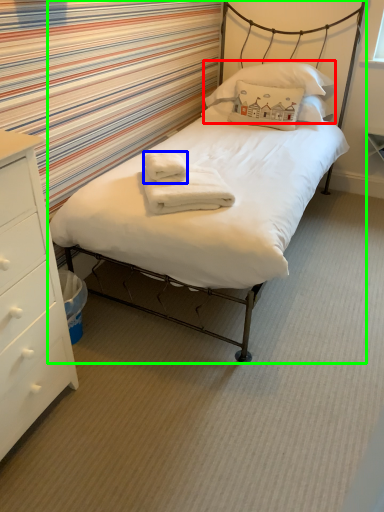
Question: Estimate the real-world distances between objects in this image. Which object is farther from pillow (highlighted by a red box), bath towel (highlighted by a blue box) or bed (highlighted by a green box)?

Choices:
 (A) bath towel
 (B) bed

Answer: (A)